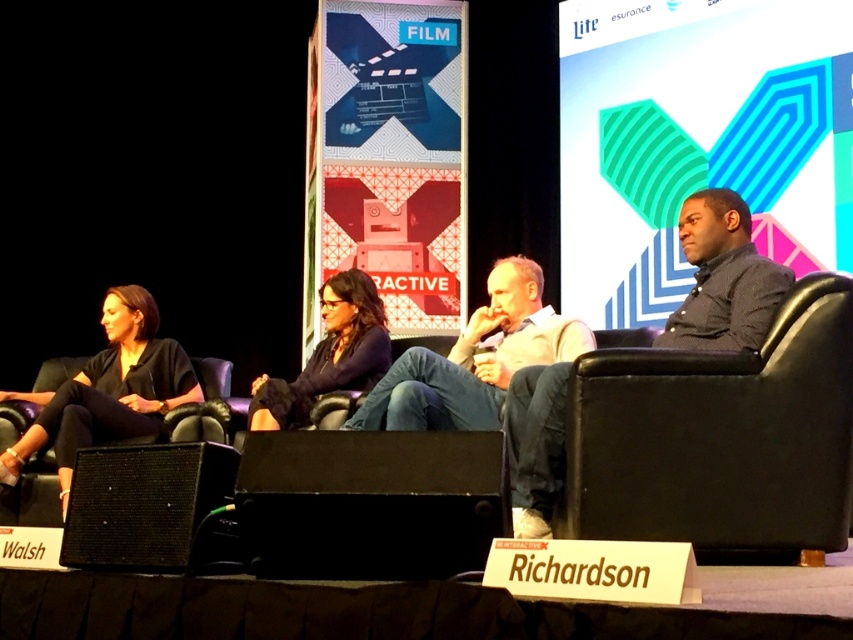
Who is more distant from viewer, [361,468] or [695,241]?

Point [695,241]

What do you see at coordinates (368, 502) in the screenshot?
I see `black matte speaker at center` at bounding box center [368, 502].

You are a GUI agent. You are given a task and a screenshot of the screen. Output one action in this format:
    pyautogui.click(x=<x>, y=<y>)
    Task: Click on the black matte speaker at center
    This screenshot has height=640, width=853.
    Given the screenshot: What is the action you would take?
    pyautogui.click(x=368, y=502)

Who is higher up, dark blue shirt at right or matte black shirt at center?

Positioned higher is dark blue shirt at right.

Which is in front, point (531, 476) or point (286, 420)?

Point (531, 476)

The height and width of the screenshot is (640, 853). Identify the location of dark blue shirt at right. (723, 276).

From the picture: Which of these two, black matte shirt at left or matte black shirt at center, stands shorter?

With less height is matte black shirt at center.

Which is below, black matte shirt at left or matte black shirt at center?

black matte shirt at left is below.

Does point (61, 387) lie in front of point (329, 369)?

Yes, it is in front of point (329, 369).

The width and height of the screenshot is (853, 640). I want to click on black matte shirt at left, so click(x=107, y=390).